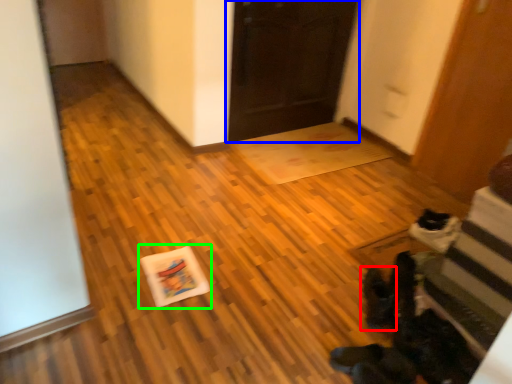
Question: Which object is positioned farthest from footwear (highlighted by a red box)? Select from door (highlighted by a blue box) and postcard (highlighted by a green box).

Choices:
 (A) door
 (B) postcard

Answer: (A)